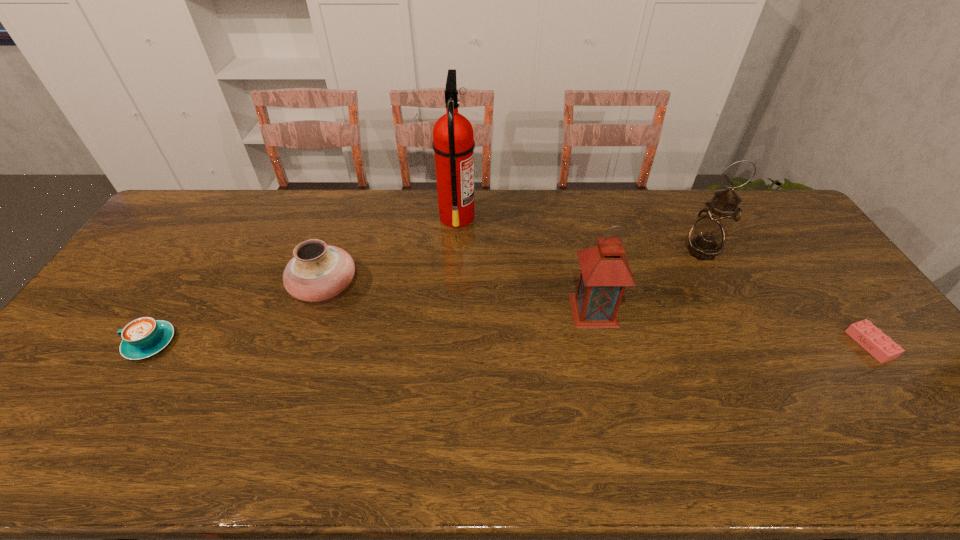
Locate an element on the screen. the shortest object is located at coordinates pyautogui.click(x=872, y=339).

Where is `free space located on the side of the tallest object near the handle`? This screenshot has width=960, height=540. free space located on the side of the tallest object near the handle is located at coordinates coord(532,217).

Locate an element on the screen. free space located 0.060m on the left of the oil lamp is located at coordinates (665, 251).

Image resolution: width=960 pixels, height=540 pixels. In order to click on vacant area located 0.370m on the left of the third object from right to left in this screenshot , I will do `click(443, 310)`.

At what (x,y) coordinates should I click in order to perform the action: click on free space located on the left of the pottery. Please return your answer as a coordinate pair (x, y). Looking at the image, I should click on (238, 287).

Image resolution: width=960 pixels, height=540 pixels. I want to click on vacant position located with the handle on the right side of the leftmost object, so click(x=89, y=343).

Where is `free space located with the handle on the right side of the leftmost object`? Image resolution: width=960 pixels, height=540 pixels. free space located with the handle on the right side of the leftmost object is located at coordinates (89, 343).

At what (x,y) coordinates should I click in order to perform the action: click on vacant area situated on the back of the shortest object. Please return your answer as a coordinate pair (x, y). The image size is (960, 540). Looking at the image, I should click on (796, 245).

Where is `object at the far edge`? object at the far edge is located at coordinates (453, 143).

What are the coordinates of `object located at the left edge` in the screenshot? It's located at (143, 337).